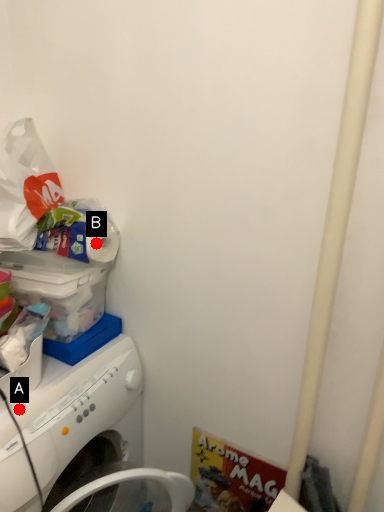
Question: Two points are circled on the image, labeled by A and B beside each circle. Which point appears farthest from the camera in this image?

Choices:
 (A) A is further
 (B) B is further

Answer: (B)